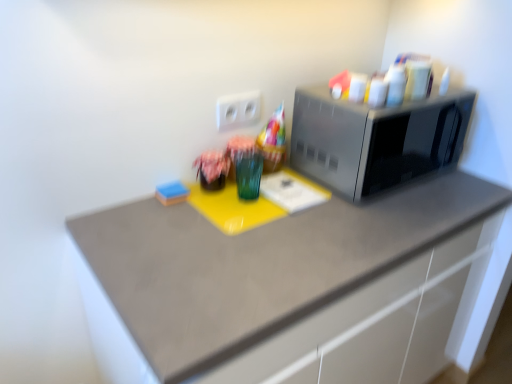
Find the location of `free space in front of matte fabric flower at center`. free space in front of matte fabric flower at center is located at coordinates (192, 223).